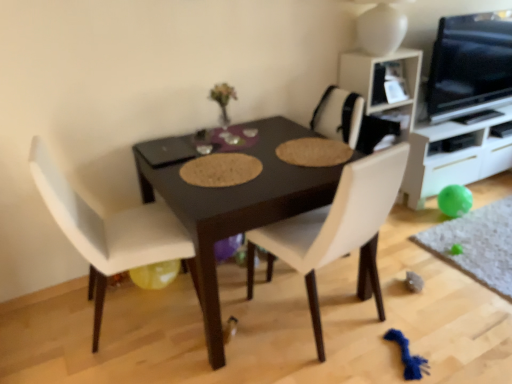
Locate an element on the screen. dark wood table at center is located at coordinates (237, 206).

This screenshot has height=384, width=512. What do you see at coordinates (477, 244) in the screenshot? I see `green rubber ball at lower right` at bounding box center [477, 244].

The height and width of the screenshot is (384, 512). Identify the location of green rubber ball at lower right. (477, 244).

Find the location of `yellow rubber balloon at lower left`. yellow rubber balloon at lower left is located at coordinates (155, 274).

This screenshot has height=384, width=512. What are the coordinates of `white leather chair at left, acting as the 2th chair starting from the right` in the screenshot? It's located at (110, 231).

I want to click on dark wood table at center, so click(237, 206).

Does white glossy cabinet at right have a smaller size compared to yellow rubber balloon at lower left?

Actually, white glossy cabinet at right might be larger than yellow rubber balloon at lower left.

Where is `balloon in front of the white glossy cabinet at right`? This screenshot has height=384, width=512. balloon in front of the white glossy cabinet at right is located at coordinates pos(155,274).

Is white glossy cabinet at right in contact with yellow rubber balloon at lower left?

There is a gap between white glossy cabinet at right and yellow rubber balloon at lower left.

Is white glossy cabinet at right looking in the opposite direction of yellow rubber balloon at lower left?

That's not correct — white glossy cabinet at right is not looking away from yellow rubber balloon at lower left.

In terms of width, does green rubber ball at lower right look wider or thinner when compared to white glossy cabinet at right?

In the image, green rubber ball at lower right appears to be wider than white glossy cabinet at right.

Does green rubber ball at lower right have a larger size compared to white glossy cabinet at right?

No.

In the scene shown: Which object is positioned more to the left, green rubber ball at lower right or white glossy cabinet at right?

From the viewer's perspective, white glossy cabinet at right appears more on the left side.

Considering the positions of point (467, 216) and point (426, 182), is point (467, 216) closer or farther from the camera than point (426, 182)?

Point (467, 216) appears to be closer to the viewer than point (426, 182).

Consider the image. Is yellow rubber balloon at lower left in contact with green rubber ball at lower right?

They are not placed beside each other.

Is point (180, 265) in front of point (434, 246)?

Yes.

Would you say yellow rubber balloon at lower left is outside green rubber ball at lower right?

yellow rubber balloon at lower left lies outside green rubber ball at lower right's area.

From a real-world perspective, which object stands above the other?

From a 3D spatial view, yellow rubber balloon at lower left is above.

Looking at this image, is yellow rubber balloon at lower left at the left side of white leather chair at center, the second chair from the left?

Correct, you'll find yellow rubber balloon at lower left to the left of white leather chair at center, the second chair from the left.

Is yellow rubber balloon at lower left oriented towards white leather chair at center, the second chair from the left?

No.

From the image's perspective, which object appears higher, yellow rubber balloon at lower left or white leather chair at center, the second chair from the left?

From the image's view, white leather chair at center, the second chair from the left, is above.

I want to click on the 2nd chair above the yellow rubber balloon at lower left (from the image's perspective), so click(336, 228).

You are a GUI agent. You are given a task and a screenshot of the screen. Output one action in this format:
    pyautogui.click(x=<x>, y=<y>)
    Task: Click on the entertainment center that appears on the right of dark wood table at center
    This screenshot has width=512, height=384.
    Given the screenshot: What is the action you would take?
    pyautogui.click(x=455, y=157)

Consider the image. From a real-world perspective, relative to dark wood table at center, is white glossy cabinet at right vertically above or below?

From a real-world perspective, white glossy cabinet at right is physically below dark wood table at center.

From the image's perspective, is white glossy cabinet at right positioned above or below dark wood table at center?

From the image's perspective, white glossy cabinet at right appears above dark wood table at center.

Is white glossy cabinet at right thinner than dark wood table at center?

Indeed, white glossy cabinet at right has a lesser width compared to dark wood table at center.

Is point (479, 260) closer to viewer compared to point (285, 206)?

No, it is not.

How distant is green rubber ball at lower right from dark wood table at center?

The distance of green rubber ball at lower right from dark wood table at center is 4.18 feet.

Who is shorter, green rubber ball at lower right or dark wood table at center?

green rubber ball at lower right.

Find the location of `table that is above the green rubber ball at lower right (from the image's perspective)`. table that is above the green rubber ball at lower right (from the image's perspective) is located at coordinates (237, 206).

Is yellow rubber balloon at lower left in contact with dark wood table at center?

No, yellow rubber balloon at lower left is not making contact with dark wood table at center.

Is dark wood table at center a part of yellow rubber balloon at lower left?

No, dark wood table at center is not surrounded by yellow rubber balloon at lower left.

From the image's perspective, which is above, yellow rubber balloon at lower left or dark wood table at center?

dark wood table at center appears higher in the image.

Which is more to the left, yellow rubber balloon at lower left or dark wood table at center?

Positioned to the left is yellow rubber balloon at lower left.

Find the location of a particular element. balloon lying in front of the white glossy cabinet at right is located at coordinates (155, 274).

Find the location of a particular element. The width and height of the screenshot is (512, 384). entertainment center above the green rubber ball at lower right (from a real-world perspective) is located at coordinates (455, 157).

Which object lies further to the anchor point white leather chair at center, the first chair positioned from the right, green rubber ball at lower right or yellow rubber balloon at lower left?

Among the two, green rubber ball at lower right is located further to white leather chair at center, the first chair positioned from the right.

Considering their positions, is white leather chair at left, acting as the 2th chair starting from the right, positioned further to green rubber ball at lower right than yellow rubber balloon at lower left?

white leather chair at left, acting as the 2th chair starting from the right, is positioned further to the anchor green rubber ball at lower right.

When comparing their distances from green rubber ball at lower right, does yellow rubber balloon at lower left or white leather chair at left, the 1th chair in the left-to-right sequence, seem further?

Based on the image, white leather chair at left, the 1th chair in the left-to-right sequence, appears to be further to green rubber ball at lower right.

From the image, which object appears to be nearer to yellow rubber balloon at lower left, white leather chair at left, acting as the 2th chair starting from the right, or green rubber ball at lower right?

white leather chair at left, acting as the 2th chair starting from the right, is positioned closer to the anchor yellow rubber balloon at lower left.

When comparing their distances from yellow rubber balloon at lower left, does white leather chair at left, acting as the 2th chair starting from the right, or white leather chair at center, the first chair positioned from the right, seem further?

white leather chair at center, the first chair positioned from the right, is further to yellow rubber balloon at lower left.

Based on their spatial positions, is white glossy cabinet at right or white leather chair at left, acting as the 2th chair starting from the right, further from dark wood table at center?

white glossy cabinet at right.

Based on their spatial positions, is yellow rubber balloon at lower left or green rubber ball at lower right closer to white glossy cabinet at right?

green rubber ball at lower right is positioned closer to the anchor white glossy cabinet at right.

Looking at the image, which one is located further to dark wood table at center, white leather chair at center, the first chair positioned from the right, or green rubber ball at lower right?

Based on the image, green rubber ball at lower right appears to be further to dark wood table at center.

Locate an element on the screen. The image size is (512, 384). chair between dark wood table at center and green rubber ball at lower right from left to right is located at coordinates (336, 228).

Find the location of a particular element. This screenshot has width=512, height=384. chair between dark wood table at center and white glossy cabinet at right in the horizontal direction is located at coordinates (336, 228).

Identify the location of table situated between white leather chair at left, the 1th chair in the left-to-right sequence, and white glossy cabinet at right from left to right. The width and height of the screenshot is (512, 384). (237, 206).

Identify the location of entertainment center situated between white leather chair at left, the 1th chair in the left-to-right sequence, and green rubber ball at lower right from left to right. This screenshot has height=384, width=512. (455, 157).